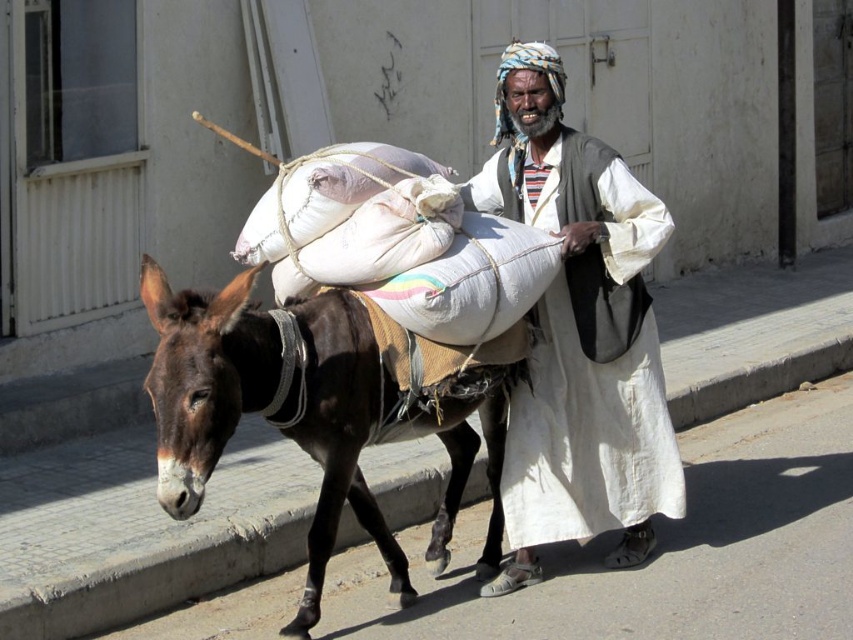
Between white cotton dress at center and brown rough skin mule at center, which one has more height?

With more height is white cotton dress at center.

How much distance is there between white cotton dress at center and brown rough skin mule at center?

A distance of 78.41 centimeters exists between white cotton dress at center and brown rough skin mule at center.

At what (x,y) coordinates should I click in order to perform the action: click on white cotton dress at center. Please return your answer as a coordinate pair (x, y). Looking at the image, I should click on (579, 333).